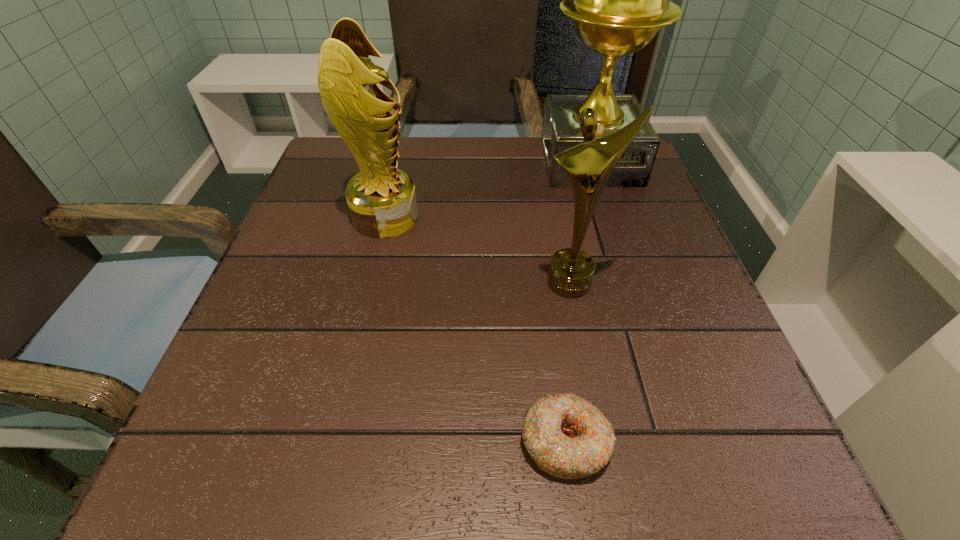
Locate an element on the screen. vacant space located on the front-facing side of the third farthest object is located at coordinates (587, 364).

Where is `vacant space located on the right of the doughnut`? Image resolution: width=960 pixels, height=540 pixels. vacant space located on the right of the doughnut is located at coordinates (772, 442).

Find the location of a particular element. object present at the far edge is located at coordinates (619, 0).

At what (x,y) coordinates should I click in order to perform the action: click on object located at the near edge. Please return your answer as a coordinate pair (x, y). The height and width of the screenshot is (540, 960). Looking at the image, I should click on (567, 436).

Find the location of a particular element. The width and height of the screenshot is (960, 540). object positioned at the left edge is located at coordinates coord(382,202).

Locate an element on the screen. The image size is (960, 540). object that is positioned at the right edge is located at coordinates (619, 0).

Where is `object at the far right corner`? Image resolution: width=960 pixels, height=540 pixels. object at the far right corner is located at coordinates (619, 0).

Find the location of `vacant space at the far edge`. vacant space at the far edge is located at coordinates (498, 150).

In the image, there is a desktop. Where is `free space at the near edge`? free space at the near edge is located at coordinates (522, 448).

The image size is (960, 540). Identify the location of vacant space at the left edge of the desktop. (251, 421).